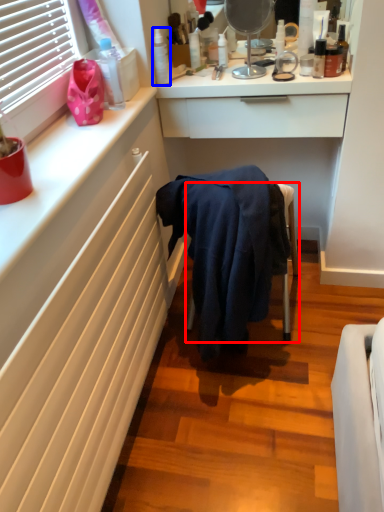
Question: Which object appears farthest to the camera in this image, furniture (highlighted by a red box) or toiletry (highlighted by a blue box)?

Choices:
 (A) furniture
 (B) toiletry

Answer: (B)